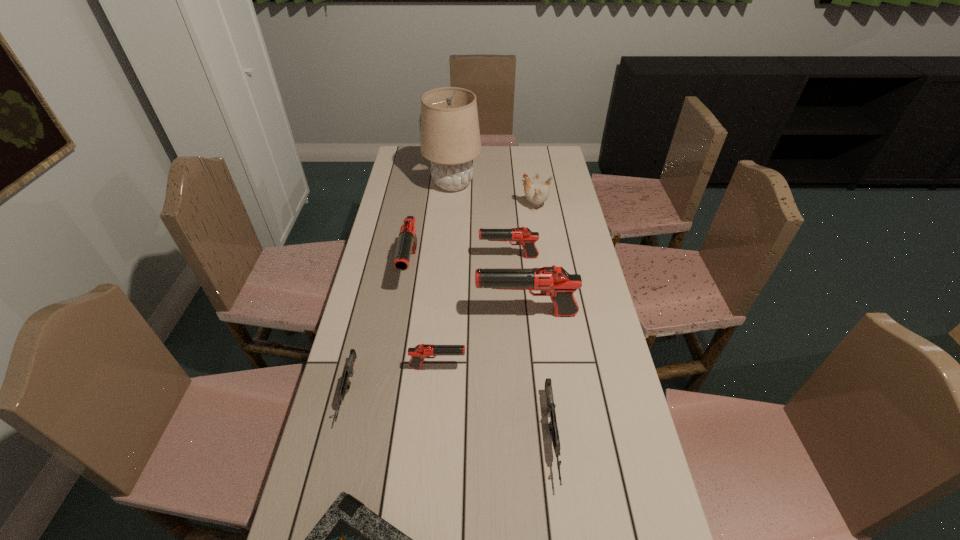
This screenshot has height=540, width=960. Find the location of `lampshade`. lampshade is located at coordinates [450, 137].

Identify the location of the second nearest black gun. The height and width of the screenshot is (540, 960). (556, 282).

The image size is (960, 540). Identify the location of the biggest black gun. (556, 282).

Locate an element on the screen. Image resolution: width=960 pixels, height=540 pixels. the second biggest black gun is located at coordinates (407, 243).

Find the location of `the fifth gun from right to left`. the fifth gun from right to left is located at coordinates (407, 243).

Locate an element on the screen. Image resolution: width=960 pixels, height=540 pixels. bird is located at coordinates (536, 192).

The width and height of the screenshot is (960, 540). I want to click on the third tallest gun, so click(523, 236).

Locate an element on the screen. the second black gun from left to right is located at coordinates (422, 351).

You are a GUI agent. You are given a task and a screenshot of the screen. Output one action in this format:
    pyautogui.click(x=<x>, y=<y>)
    Task: Click on the smallest black gun
    The width and height of the screenshot is (960, 540).
    Given the screenshot: What is the action you would take?
    pyautogui.click(x=422, y=351)

The height and width of the screenshot is (540, 960). Find the location of `the second shortest gun`. the second shortest gun is located at coordinates click(x=554, y=433).